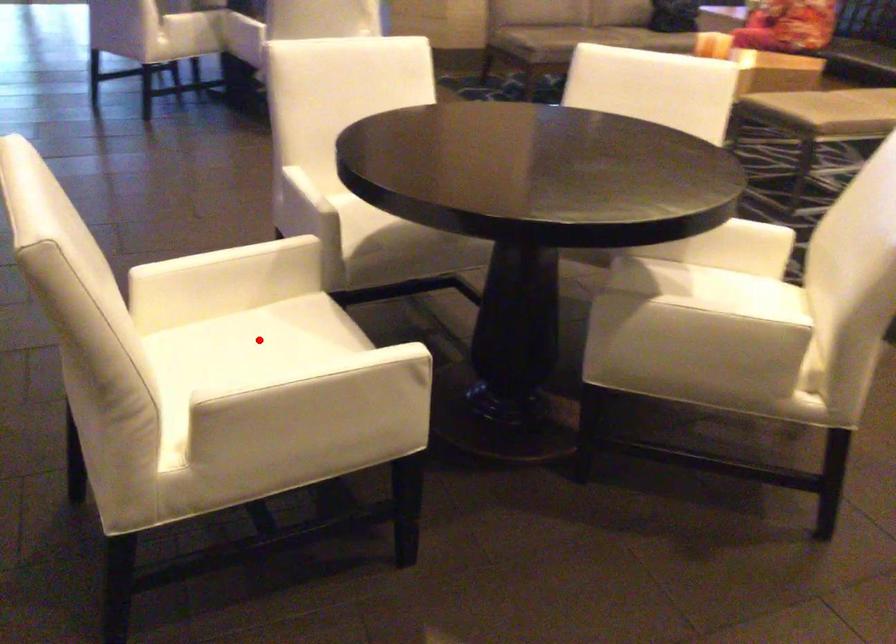
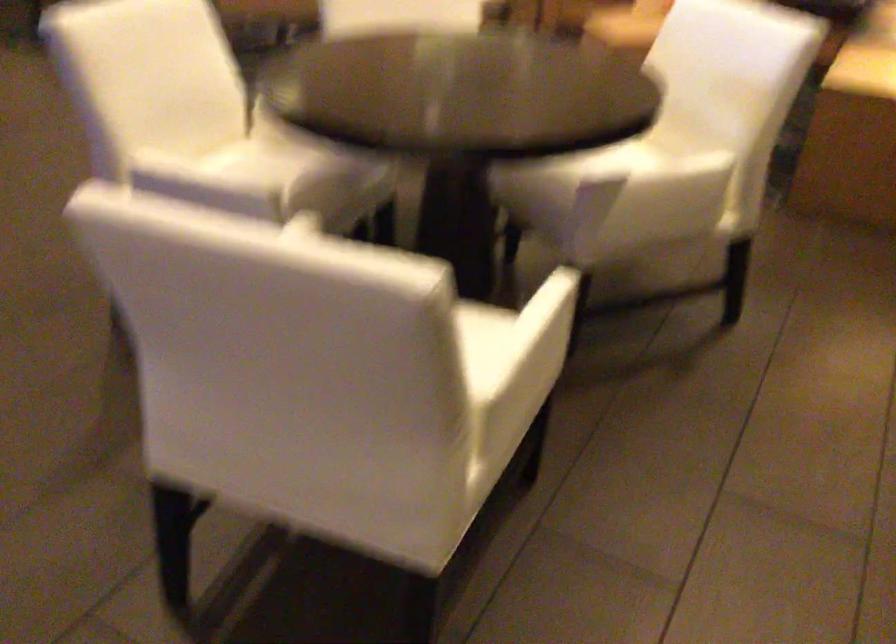
Question: I am providing you with two images of the same scene from different viewpoints. A red point is marked on the first image. Is the red point's position out of view in image 2?

Choices:
 (A) Yes
 (B) No

Answer: (A)